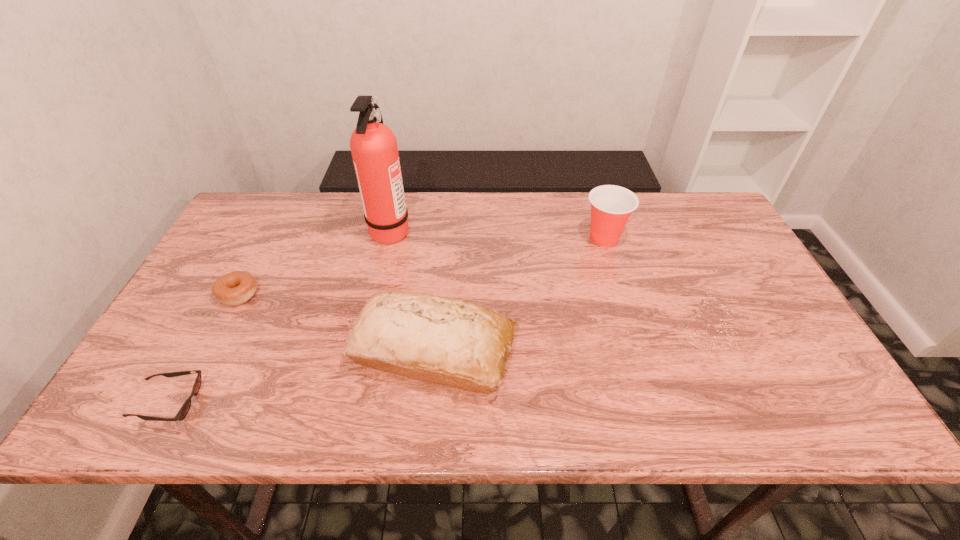
The image size is (960, 540). What are the coordinates of `fire extinguisher` in the screenshot? It's located at (373, 145).

At what (x,y) coordinates should I click in order to perform the action: click on the rightmost object. Please return your answer as a coordinate pair (x, y). Image resolution: width=960 pixels, height=540 pixels. Looking at the image, I should click on (611, 206).

The height and width of the screenshot is (540, 960). I want to click on bread, so click(445, 341).

Where is `the second shortest object`? The image size is (960, 540). the second shortest object is located at coordinates (235, 288).

The height and width of the screenshot is (540, 960). I want to click on sunglasses, so click(185, 408).

Where is `vacant space located 0.210m on the handle side of the fire extinguisher`? The height and width of the screenshot is (540, 960). vacant space located 0.210m on the handle side of the fire extinguisher is located at coordinates (480, 231).

This screenshot has width=960, height=540. I want to click on free space located on the right of the cup, so click(x=716, y=238).

The width and height of the screenshot is (960, 540). I want to click on vacant area located 0.340m on the back of the bread, so click(445, 224).

At what (x,y) coordinates should I click in order to perform the action: click on free space located on the right of the bagel. Please return your answer as a coordinate pair (x, y). The height and width of the screenshot is (540, 960). Looking at the image, I should click on (365, 294).

The height and width of the screenshot is (540, 960). Identify the location of free region located 0.210m on the front-facing side of the shortest object. (297, 402).